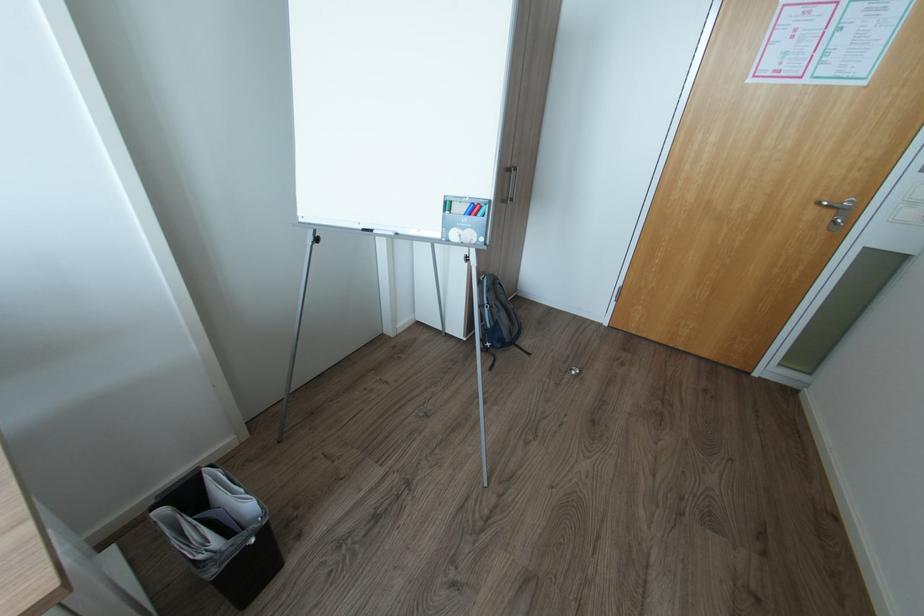
At what (x,y) coordinates should I click in order to perform the action: click on blue and gray backpack. Please return your answer as a coordinate pair (x, y). This screenshot has height=616, width=924. Looking at the image, I should click on (496, 314).